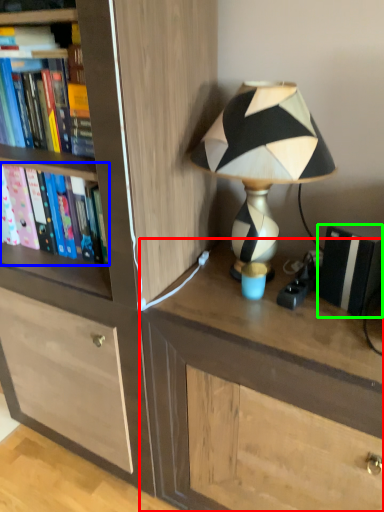
Question: Which object is the closest to the desk (highlighted by a red box)? Choose among these: book (highlighted by a blue box) or paperback book (highlighted by a green box).

Choices:
 (A) book
 (B) paperback book

Answer: (B)